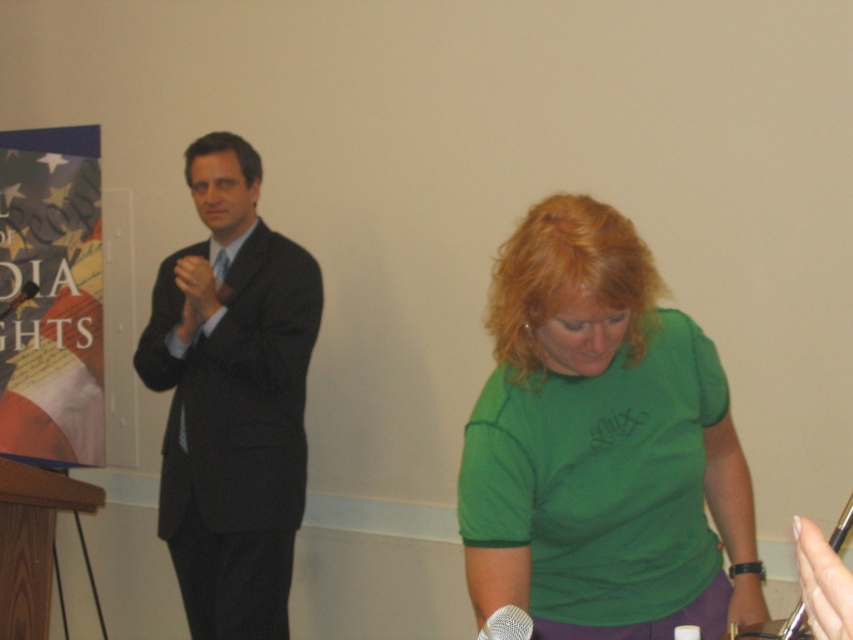
Question: Is dark gray suit at left wider than camouflage paper poster at left?

Choices:
 (A) yes
 (B) no

Answer: (A)

Question: Does dark gray suit at left have a greater width compared to camouflage paper poster at left?

Choices:
 (A) yes
 (B) no

Answer: (A)

Question: Which object is closer to the camera taking this photo?

Choices:
 (A) silver metallic microphone at lower center
 (B) wooden at left
 (C) camouflage paper poster at left
 (D) dark gray suit at left

Answer: (A)

Question: Which of the following is the closest to the observer?

Choices:
 (A) wooden at left
 (B) green matte shirt at lower right
 (C) dark gray suit at left

Answer: (B)

Question: Can you confirm if green matte shirt at lower right is positioned below camouflage paper poster at left?

Choices:
 (A) no
 (B) yes

Answer: (B)

Question: Which of the following is the farthest from the observer?

Choices:
 (A) green matte shirt at lower right
 (B) dark gray suit at left
 (C) camouflage paper poster at left
 (D) wooden at left

Answer: (C)